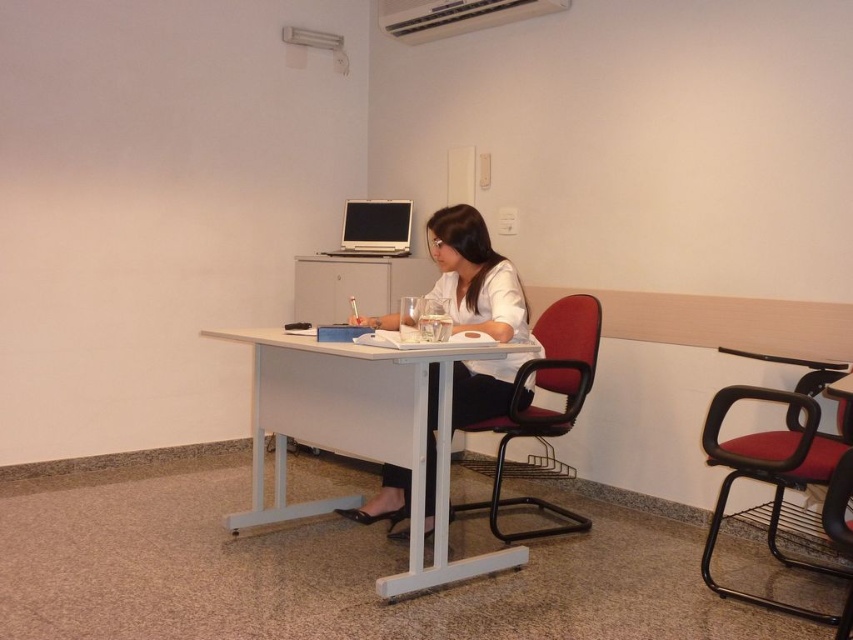
Question: Does white matte shirt at center lie in front of matte black chair at center?

Choices:
 (A) yes
 (B) no

Answer: (A)

Question: From the image, what is the correct spatial relationship of white matte shirt at center in relation to black plastic swivel chair at right?

Choices:
 (A) right
 (B) left

Answer: (B)

Question: Which point is closer to the camera?

Choices:
 (A) (595, 353)
 (B) (413, 10)
 (C) (724, 481)
 (D) (457, 234)

Answer: (C)

Question: Which object is positioned closest to the white matte shirt at center?

Choices:
 (A) silver metallic laptop at center
 (B) white plastic air conditioner at upper center

Answer: (A)

Question: Which point appears farthest from the camera in this image?

Choices:
 (A) (387, 216)
 (B) (416, 464)
 (C) (521, 422)
 (D) (474, 4)

Answer: (A)

Question: Is white plastic table at center thinner than matte black chair at center?

Choices:
 (A) yes
 (B) no

Answer: (B)